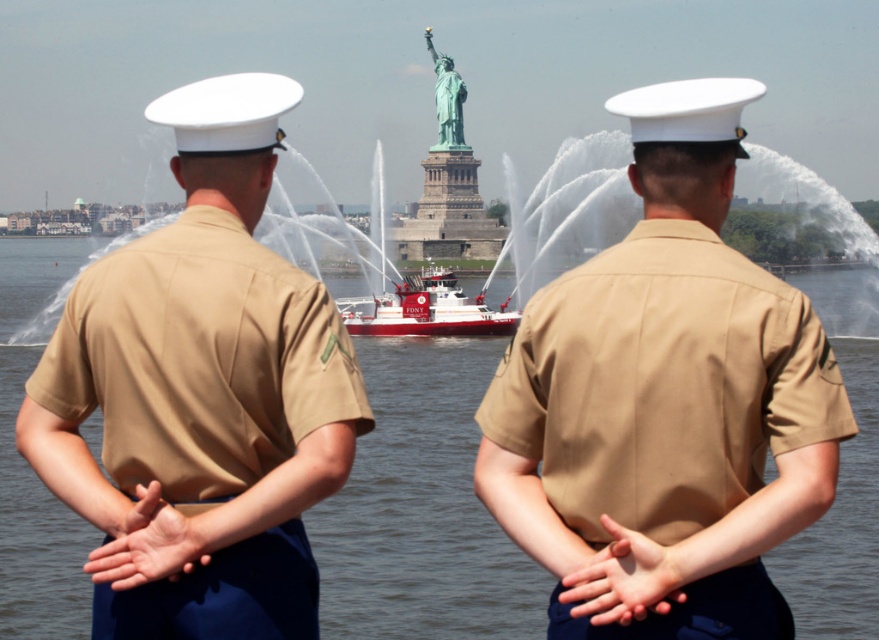
You are a tourist standing in front of the green patina statue at center and the tan cotton shirt at center. Which object is nearer to you?

The tan cotton shirt at center is closer to the viewer than the green patina statue at center.

You are a photographer trying to capture a shot of the Statue of Liberty in the background. You notice the clear water at center and the red matte fireboat at center. Which object is closer to the camera, and how does this affect your composition?

The clear water at center is located below the red matte fireboat at center, meaning the fireboat is closer to the camera. To include both in your composition, position the fireboat lower in the frame so the water appears beneath it, aligning with their spatial relationship.